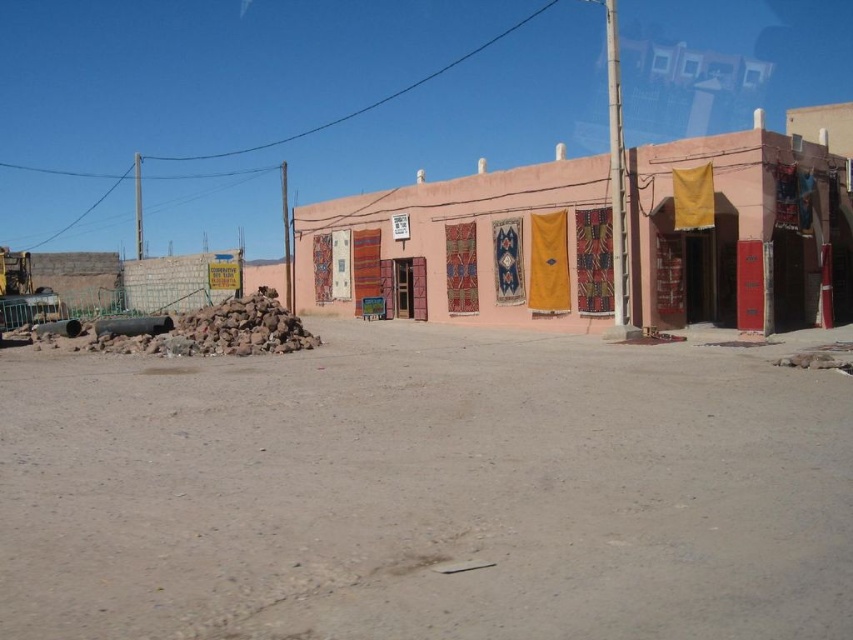
Based on the photo, you are standing in the middle of the scene and notice the dull brown dirt at center and the textured fabric clothesline at center. Which object is closer to your right side?

The textured fabric clothesline at center is closer to your right side because the dull brown dirt at center is positioned on its left side.

You are standing at the center of the image and want to move towards the single story building on the right. Is the dull brown dirt at center in your path?

The dull brown dirt at center is located at point (425, 492), so yes, it is in your path towards the single story building on the right.

You are a delivery person trying to unload a package onto the dull brown dirt at center. However, there is a textured fabric clothesline at center in the way. How can you adjust your path to avoid it?

The dull brown dirt at center is not as tall as the textured fabric clothesline at center, so you can lower the package below the clothesline or move it to the side of the clothesline to avoid collision.